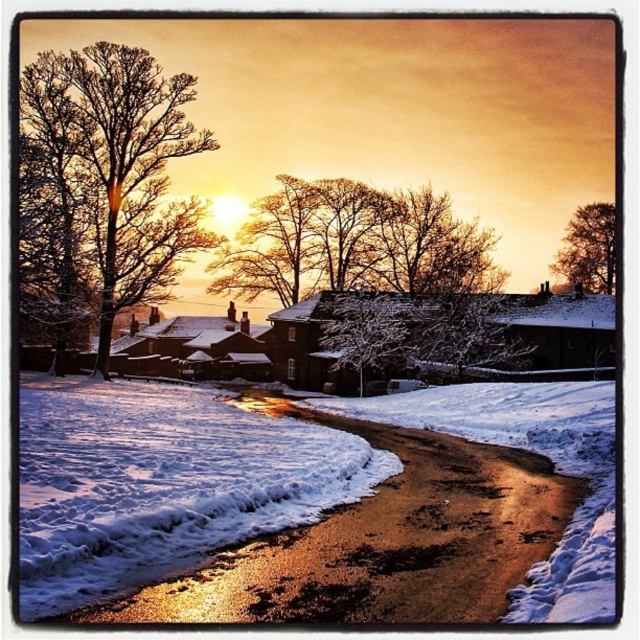
You are standing on the path and looking towards the buildings. Which object, the bare branches at left or the brown textured tree at upper right, is closer to you?

The bare branches at left is closer to you because it is in front of the brown textured tree at upper right.

You are standing on the snow path and see the bare branches at left and the brown textured tree at upper right. Which one is positioned more to the left side of the image?

The bare branches at left are positioned to the left of the brown textured tree at upper right, so they are more to the left side of the image.